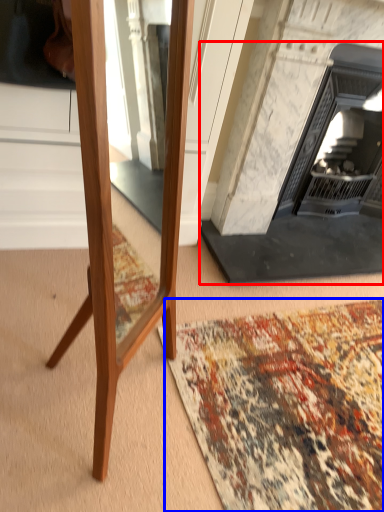
Question: Which of the following is the farthest to the observer, fireplace (highlighted by a red box) or mat (highlighted by a blue box)?

Choices:
 (A) fireplace
 (B) mat

Answer: (A)